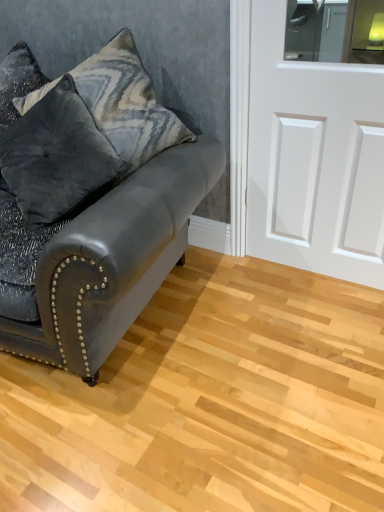
Question: Looking at the image, does velvet gray pillow at upper left, which is the first pillow in top-to-bottom order, seem bigger or smaller compared to velvet dark gray pillow at left, which is counted as the 2th pillow, starting from the top?

Choices:
 (A) small
 (B) big

Answer: (B)

Question: Looking at their shapes, would you say velvet gray pillow at upper left, which is the first pillow in top-to-bottom order, is wider or thinner than velvet dark gray pillow at left, which is counted as the 2th pillow, starting from the top?

Choices:
 (A) thin
 (B) wide

Answer: (A)

Question: Estimate the real-world distances between objects in this image. Which object is farther from the matte black leather couch at left?

Choices:
 (A) white matte door at right
 (B) velvet gray pillow at upper left, which is the first pillow in top-to-bottom order
 (C) velvet dark gray pillow at left, which is counted as the first pillow, starting from the bottom

Answer: (A)

Question: Which of these objects is positioned farthest from the white matte door at right?

Choices:
 (A) matte black leather couch at left
 (B) velvet dark gray pillow at left, which is counted as the first pillow, starting from the bottom
 (C) velvet gray pillow at upper left, which is the first pillow in top-to-bottom order

Answer: (B)